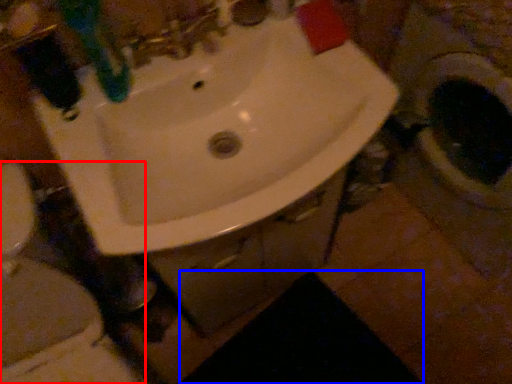
Question: Which point is closer to the camera, toilet (highlighted by a red box) or dark (highlighted by a blue box)?

Choices:
 (A) toilet
 (B) dark

Answer: (A)